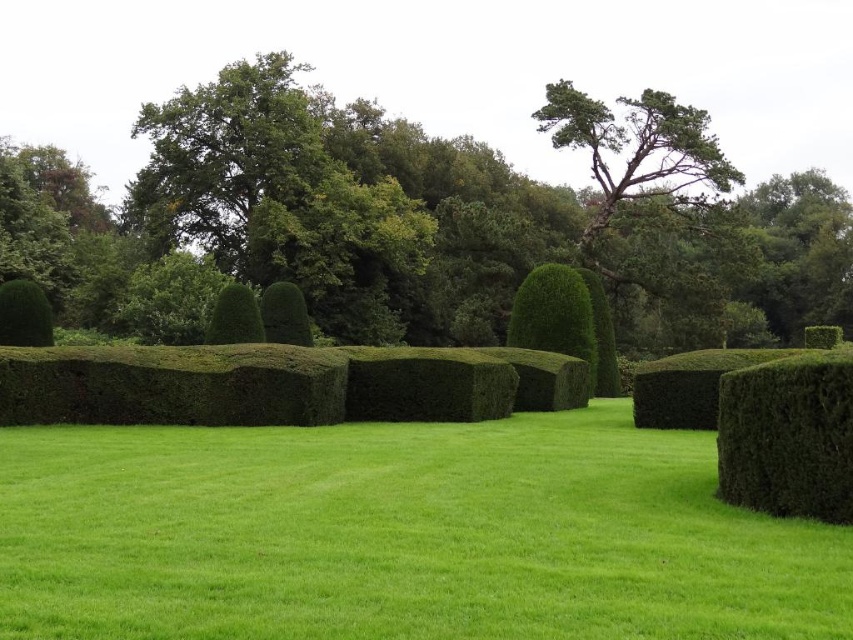
You are standing in the garden and want to place a small decorative statue exactly at the center of the green smooth grass at center. According to the coordinates provided, what are the exact coordinates where you should place the statue?

The exact coordinates for placing the statue on the green smooth grass at center are at point (401,536).

From the picture: You are standing in the garden and want to walk from the green leafy shrub at left to the green leafy tree at center. Which direction should you move to get closer to the tree?

You should move towards the green leafy tree at center. Since the green leafy tree at center is further to the viewer than the green leafy shrub at left, moving towards it would bring you closer to the tree.